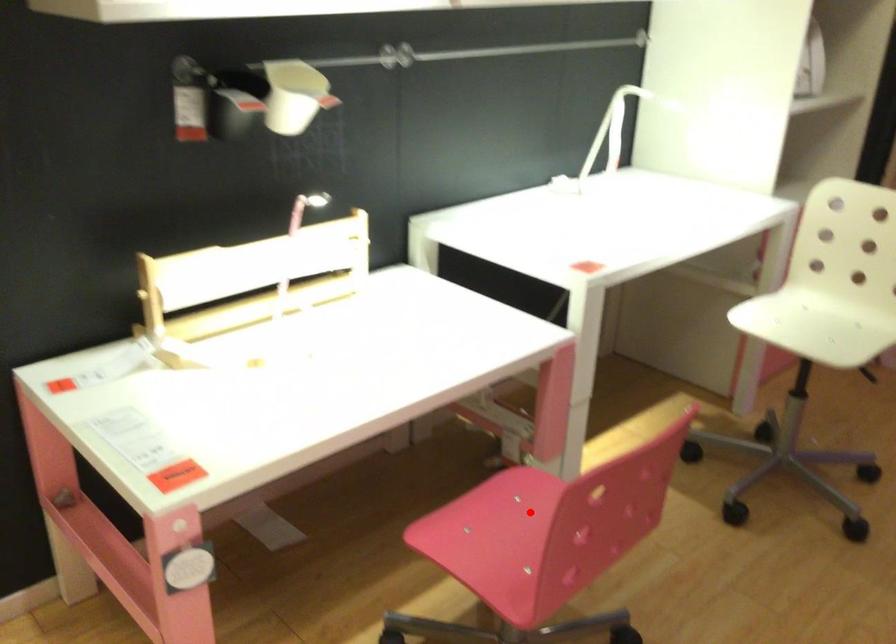
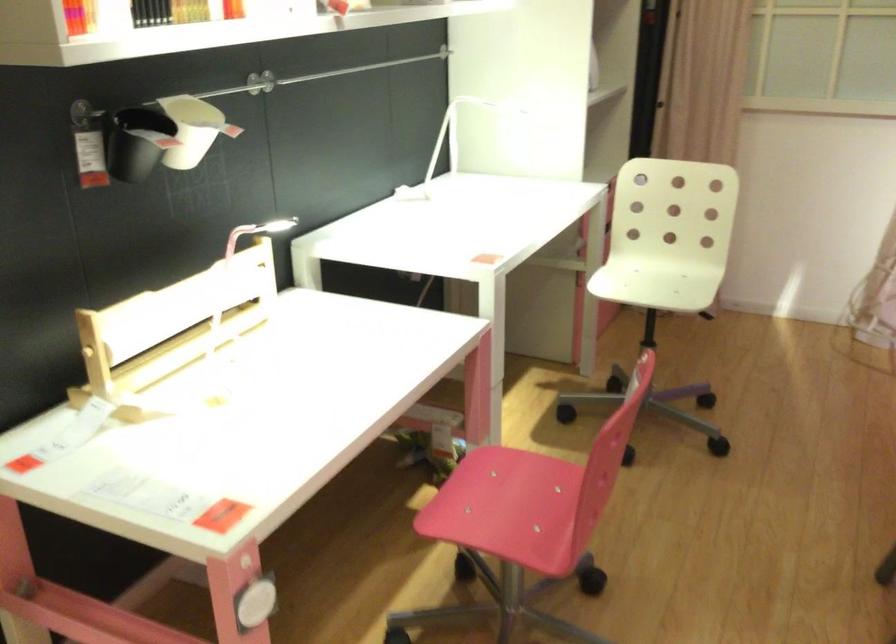
Question: I am providing you with two images of the same scene from different viewpoints. A red point is shown in image1. For the corresponding object point in image2, is it positioned nearer or farther from the camera?

Choices:
 (A) Nearer
 (B) Farther

Answer: (B)